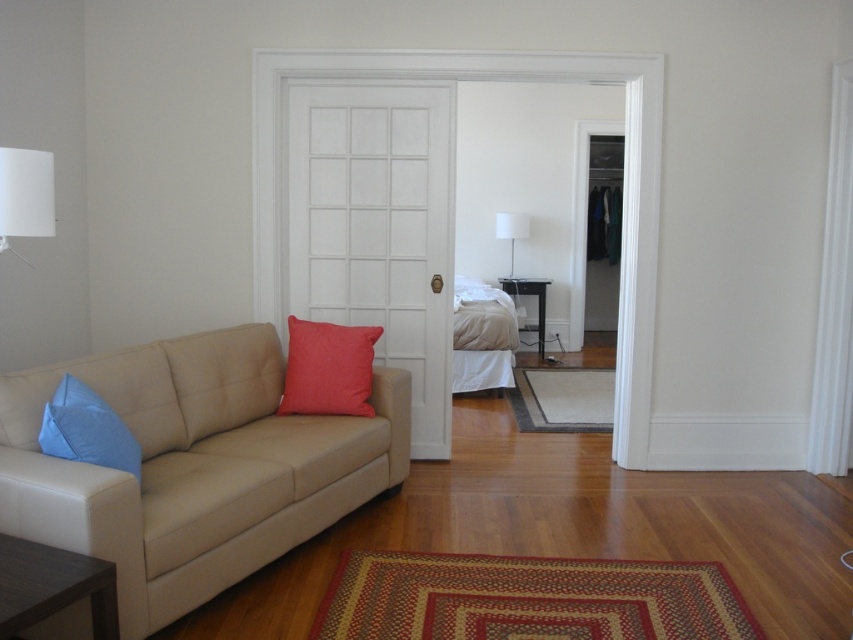
Question: Based on their relative distances, which object is farther from the blue fabric pillow at left?

Choices:
 (A) white fabric lampshade at center
 (B) black glossy hardwood at center
 (C) matte red pillow at center

Answer: (B)

Question: Is the position of white matte door at center less distant than that of white fabric lampshade at center?

Choices:
 (A) no
 (B) yes

Answer: (B)

Question: Which point is closer to the camera?

Choices:
 (A) (497, 234)
 (B) (339, 378)
 (C) (10, 161)

Answer: (C)

Question: Is beige leather couch at left to the right of white matte lampshade at upper left from the viewer's perspective?

Choices:
 (A) no
 (B) yes

Answer: (B)

Question: Which point appears farthest from the camera in this image?

Choices:
 (A) (338, 317)
 (B) (119, 451)
 (C) (13, 572)

Answer: (A)

Question: Is white matte door at center below white matte lampshade at upper left?

Choices:
 (A) no
 (B) yes

Answer: (B)